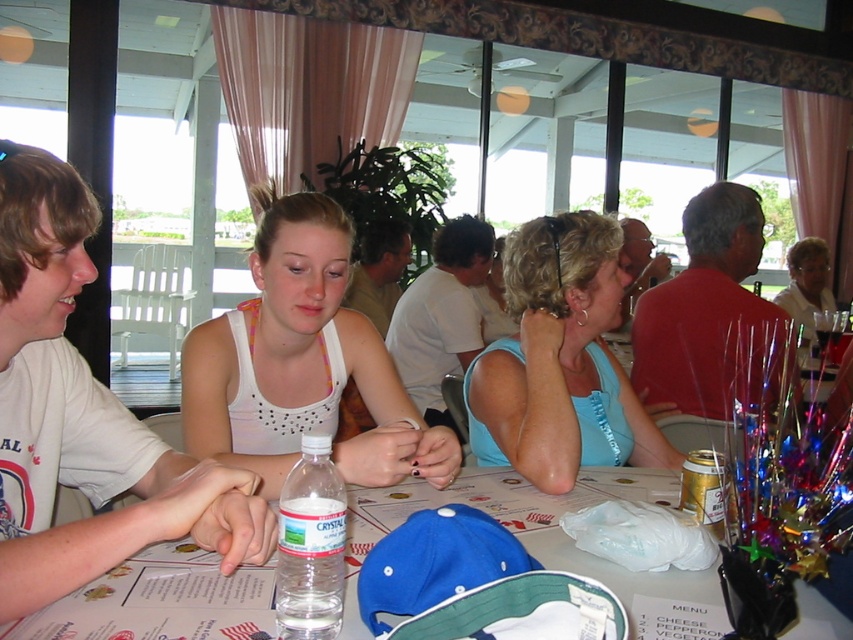
You are a customer at this restaurant and want to grab your drink. You see the white matte tank top at center and the light blue fabric tank top at center on the table. Which tank top is closer to the left edge of the table?

The white matte tank top at center is closer to the left edge of the table because it is positioned to the left of the light blue fabric tank top at center.